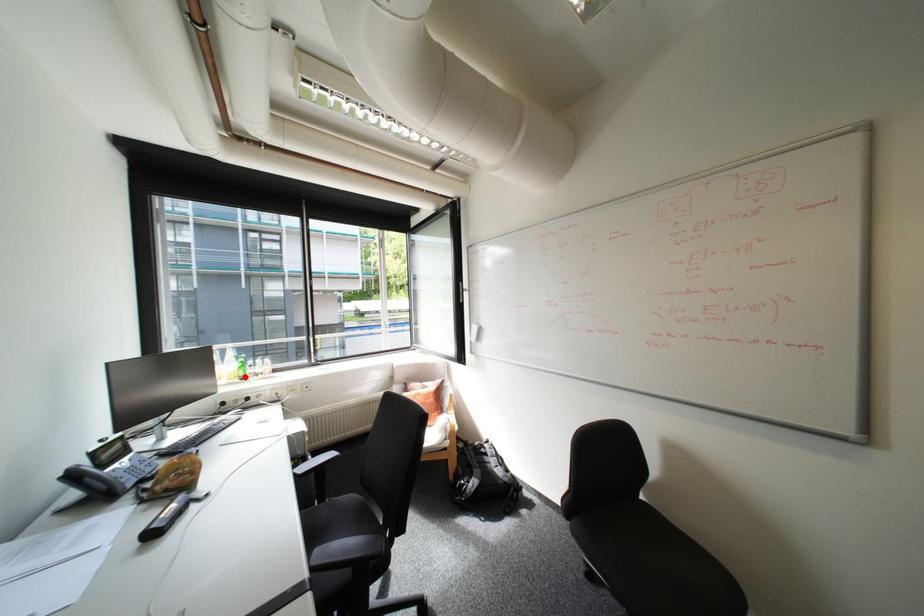
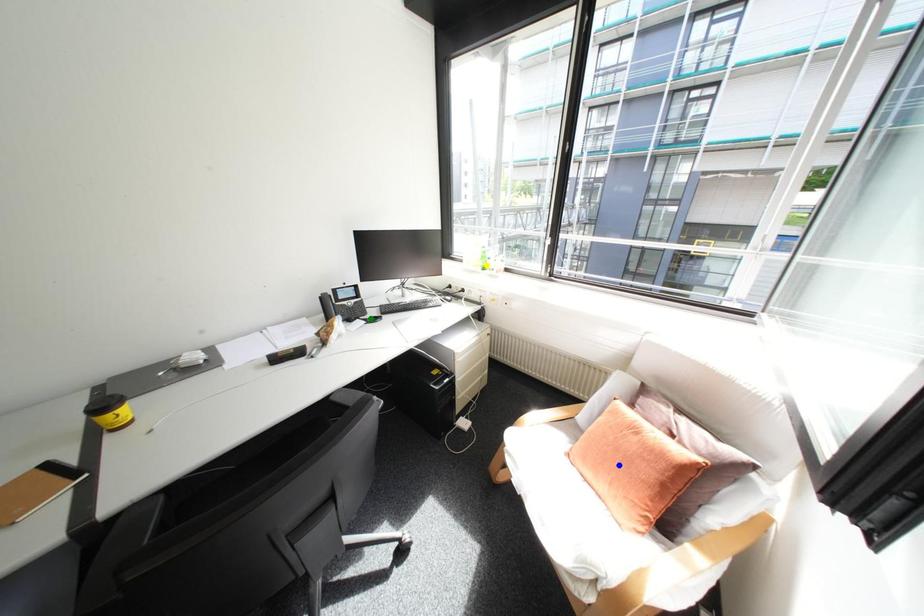
Question: I am providing you with two images of the same scene from different viewpoints. A red point is marked on the first image. You are given multiple points on the second image. Which point in image 2 is actually the same real-world point as the red point in image 1?

Choices:
 (A) green point
 (B) yellow point
 (C) blue point

Answer: (B)